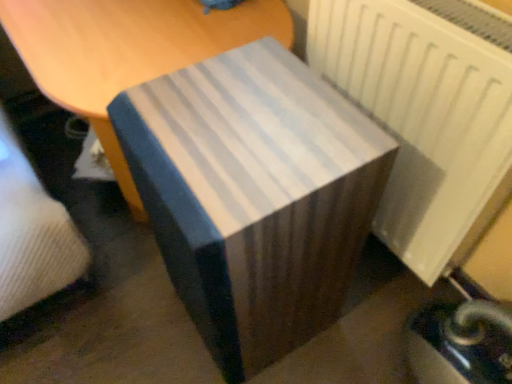
Question: Is blue striped fabric at center wider than white matte radiator at right?

Choices:
 (A) yes
 (B) no

Answer: (A)

Question: From the image's perspective, is blue striped fabric at center above white matte radiator at right?

Choices:
 (A) yes
 (B) no

Answer: (B)

Question: From a real-world perspective, is blue striped fabric at center under white matte radiator at right?

Choices:
 (A) yes
 (B) no

Answer: (A)

Question: Considering the relative sizes of blue striped fabric at center and white matte radiator at right in the image provided, is blue striped fabric at center shorter than white matte radiator at right?

Choices:
 (A) yes
 (B) no

Answer: (B)

Question: Is white matte radiator at right completely or partially inside blue striped fabric at center?

Choices:
 (A) no
 (B) yes

Answer: (A)

Question: Is white matte radiator at right spatially inside white striped fabric at center, or outside of it?

Choices:
 (A) outside
 (B) inside

Answer: (A)

Question: From a real-world perspective, is white matte radiator at right above or below white striped fabric at center?

Choices:
 (A) above
 (B) below

Answer: (A)

Question: Based on their sizes in the image, would you say white matte radiator at right is bigger or smaller than white striped fabric at center?

Choices:
 (A) big
 (B) small

Answer: (B)

Question: Considering the positions of white matte radiator at right and white striped fabric at center in the image, is white matte radiator at right taller or shorter than white striped fabric at center?

Choices:
 (A) short
 (B) tall

Answer: (B)

Question: From a real-world perspective, relative to blue striped fabric at center, is white matte radiator at right vertically above or below?

Choices:
 (A) below
 (B) above

Answer: (B)

Question: Considering the relative positions of white matte radiator at right and blue striped fabric at center in the image provided, is white matte radiator at right to the left or to the right of blue striped fabric at center?

Choices:
 (A) right
 (B) left

Answer: (A)

Question: Looking at their shapes, would you say white matte radiator at right is wider or thinner than blue striped fabric at center?

Choices:
 (A) thin
 (B) wide

Answer: (A)

Question: From the image's perspective, relative to blue striped fabric at center, is white matte radiator at right above or below?

Choices:
 (A) below
 (B) above

Answer: (B)

Question: Visually, is blue striped fabric at center positioned to the left or to the right of white matte radiator at right?

Choices:
 (A) right
 (B) left

Answer: (B)

Question: Is blue striped fabric at center in front of or behind white matte radiator at right in the image?

Choices:
 (A) front
 (B) behind

Answer: (A)